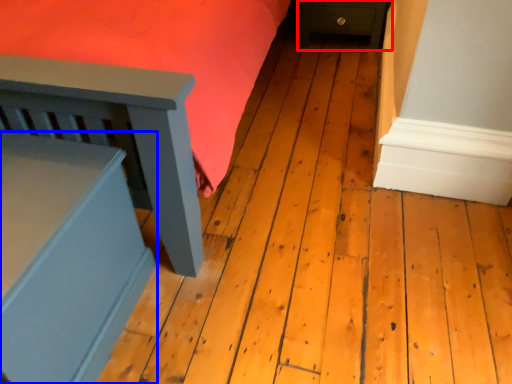
Question: Which point is closer to the camera, furniture (highlighted by a red box) or furniture (highlighted by a blue box)?

Choices:
 (A) furniture
 (B) furniture

Answer: (B)